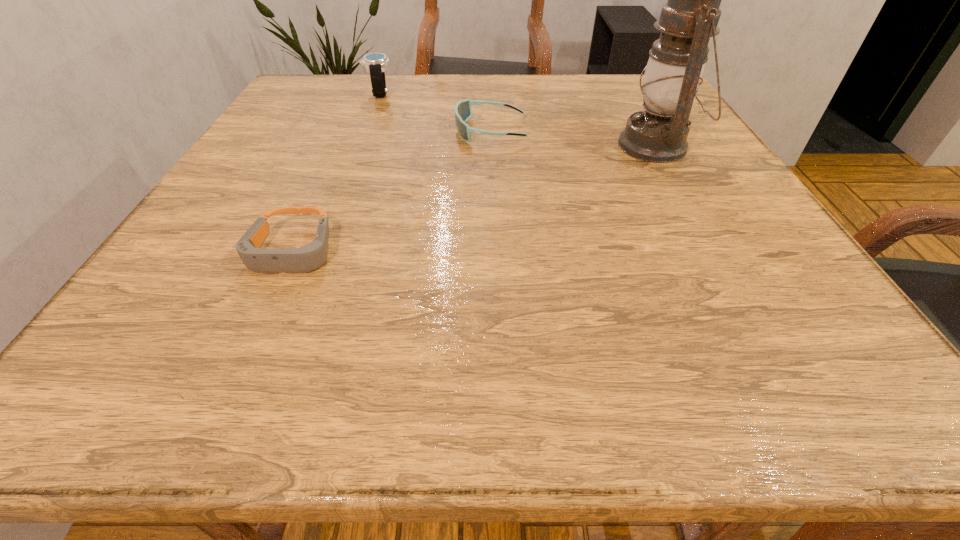
Locate an element on the screen. free point between the shortest object and the third shortest object is located at coordinates (336, 172).

Locate an element on the screen. Image resolution: width=960 pixels, height=540 pixels. free space between the shortest object and the farther goggles is located at coordinates (392, 191).

Identify the location of free space between the nearer goggles and the watch. The height and width of the screenshot is (540, 960). (336, 172).

Identify which object is located as the nearest to the tallest object. Please provide its 2D coordinates. Your answer should be formatted as a tuple, i.e. [(x, y)], where the tuple contains the x and y coordinates of a point satisfying the conditions above.

[(463, 111)]

At what (x,y) coordinates should I click in order to perform the action: click on object that is the third closest to the shortest object. Please return your answer as a coordinate pair (x, y). This screenshot has height=540, width=960. Looking at the image, I should click on (658, 134).

This screenshot has height=540, width=960. I want to click on vacant space that satisfies the following two spatial constraints: 1. on the front side of the tallest object; 2. on the right side of the second tallest object, so click(x=359, y=146).

This screenshot has width=960, height=540. Find the location of `vacant space that satisfies the following two spatial constraints: 1. on the front-facing side of the second object from right to left; 2. on the front and back of the shorter goggles`. vacant space that satisfies the following two spatial constraints: 1. on the front-facing side of the second object from right to left; 2. on the front and back of the shorter goggles is located at coordinates (494, 251).

At what (x,y) coordinates should I click in order to perform the action: click on free space that satisfies the following two spatial constraints: 1. on the front-facing side of the rightmost object; 2. on the right side of the farther goggles. Please return your answer as a coordinate pair (x, y). This screenshot has width=960, height=540. Looking at the image, I should click on (491, 146).

The width and height of the screenshot is (960, 540). What are the coordinates of `free space that satisfies the following two spatial constraints: 1. on the front-facing side of the second object from right to left; 2. on the front and back of the left goggles` in the screenshot? It's located at (494, 251).

I want to click on vacant space that satisfies the following two spatial constraints: 1. on the front-facing side of the second object from right to left; 2. on the front and back of the left goggles, so click(494, 251).